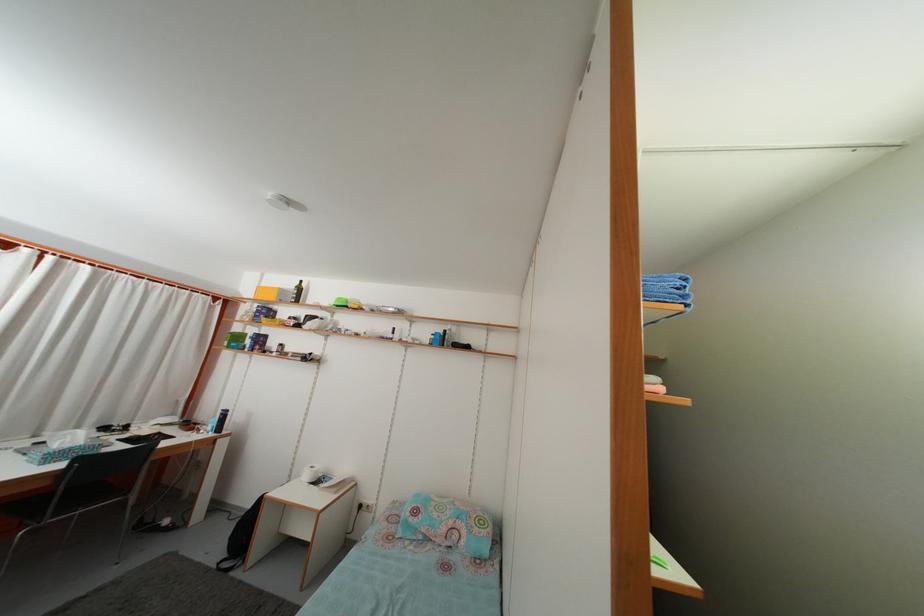
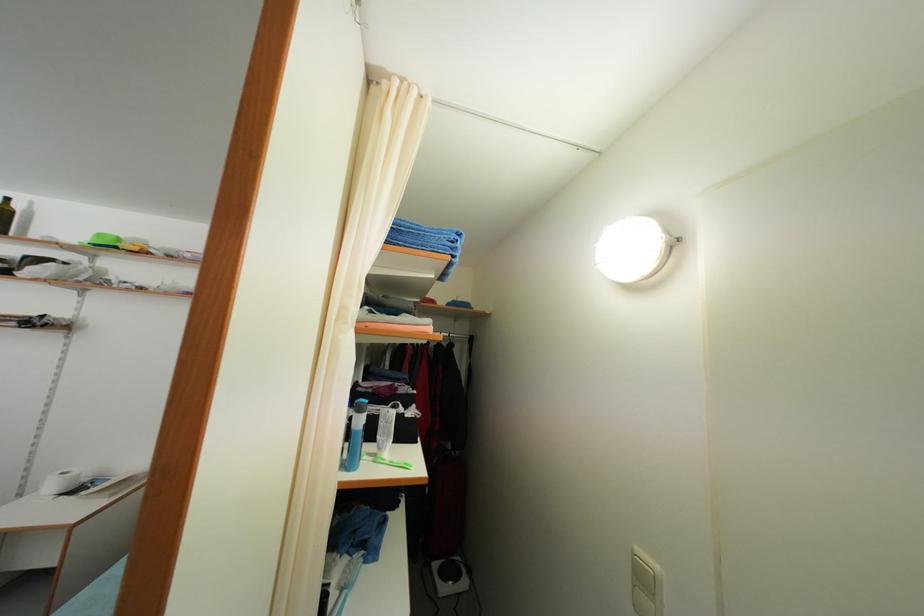
Question: The images are taken continuously from a first-person perspective. In which direction is your viewpoint rotating?

Choices:
 (A) Left
 (B) Right
 (C) Up
 (D) Down

Answer: (B)